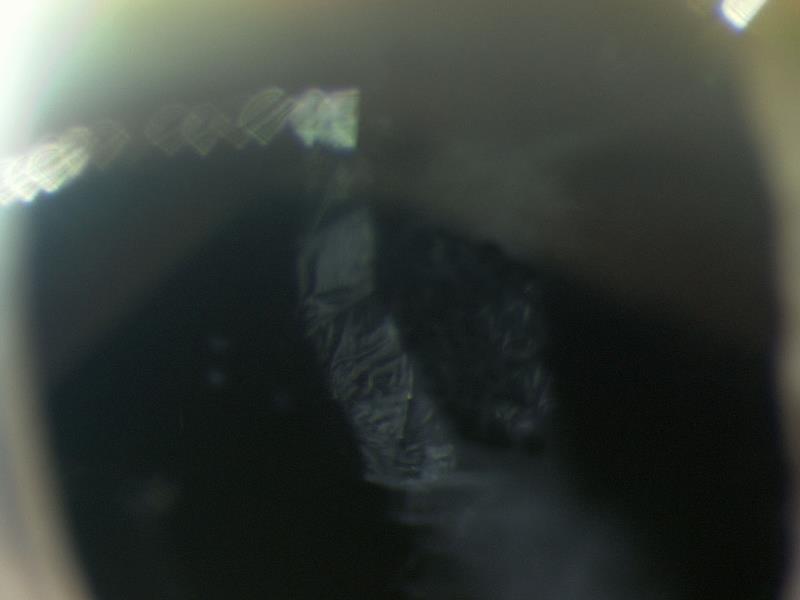
The image size is (800, 600). In order to click on empty space right of middle object in this screenshot , I will do `click(654, 345)`.